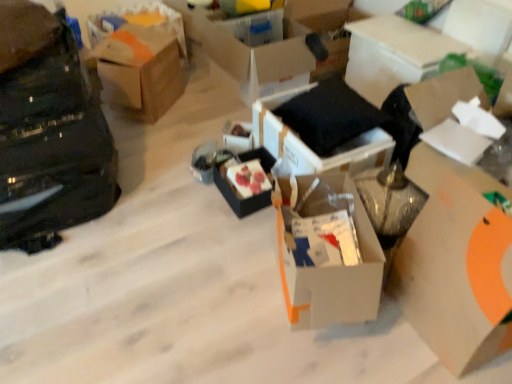
This screenshot has height=384, width=512. I want to click on free spot in front of brown cardboard box at upper left, positioned as the first box in left-to-right order, so click(x=155, y=140).